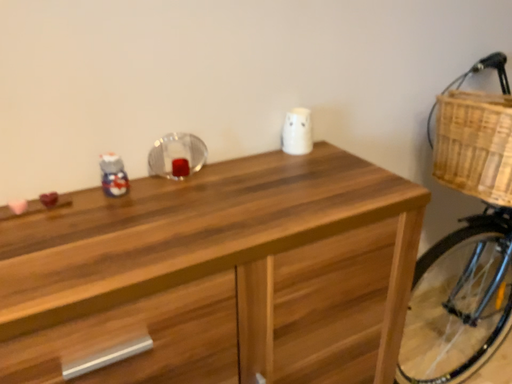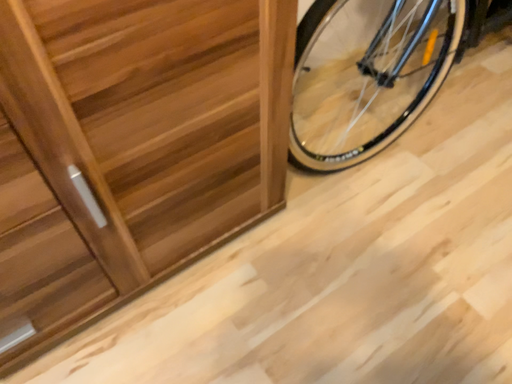
Question: Which way did the camera rotate in the video?

Choices:
 (A) rotated downward
 (B) rotated upward

Answer: (A)